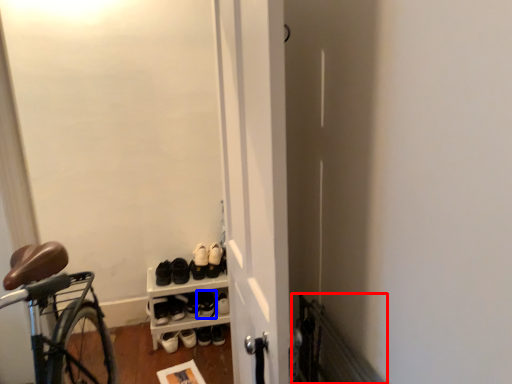
Question: Which point is closer to the camera, radiator (highlighted by a red box) or footwear (highlighted by a blue box)?

Choices:
 (A) radiator
 (B) footwear

Answer: (A)